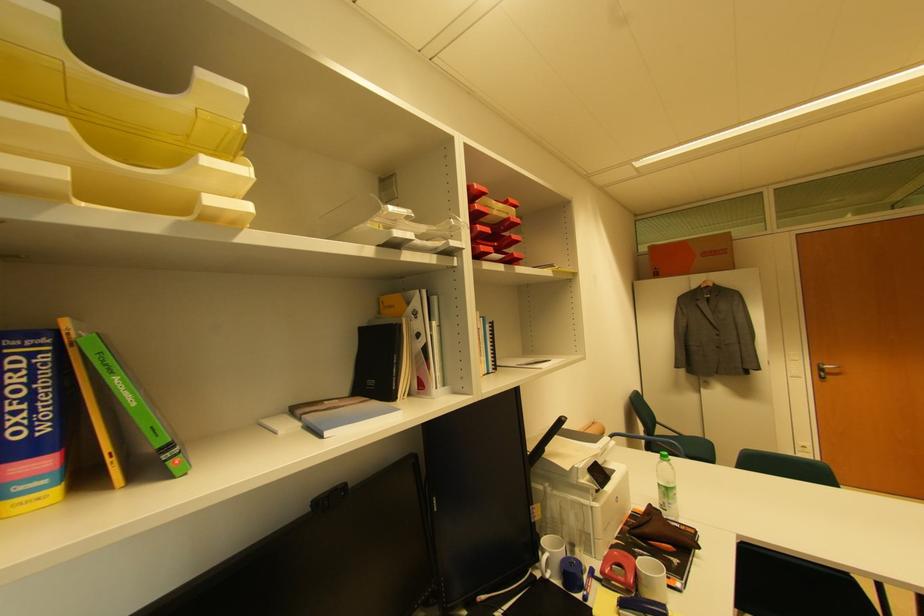
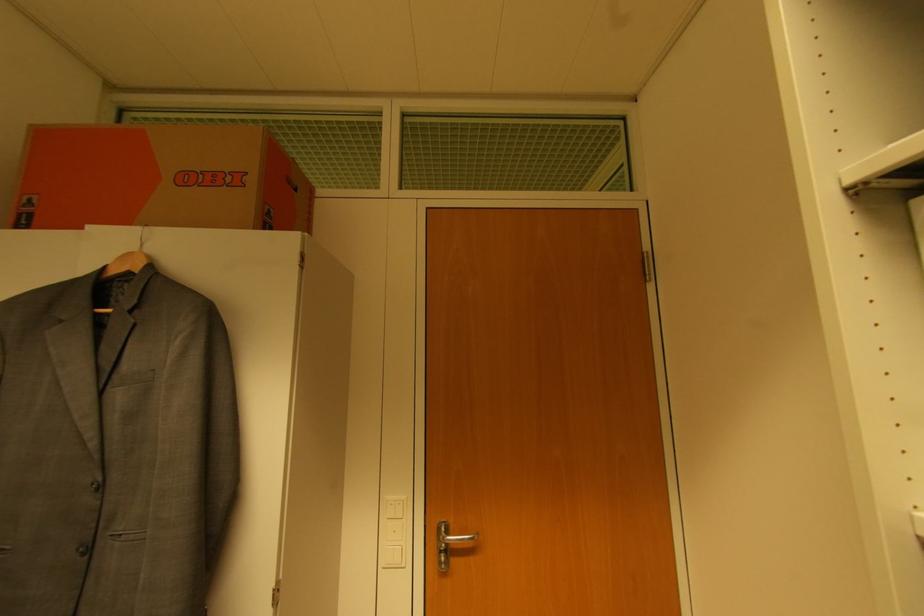
Find the pixel in the second image that matches [659,275] in the first image.

(32, 217)